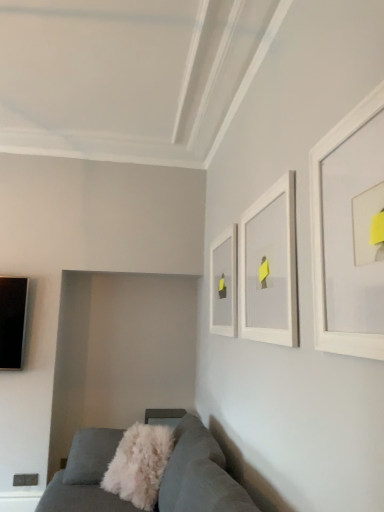
Question: Is velvet grey couch at lower left facing away from white matte picture frame at upper center, the first picture frame positioned from the left?

Choices:
 (A) no
 (B) yes

Answer: (A)

Question: Does velvet grey couch at lower left appear on the left side of white matte picture frame at upper center, which is counted as the 3th picture frame, starting from the right?

Choices:
 (A) no
 (B) yes

Answer: (B)

Question: From the image's perspective, would you say velvet grey couch at lower left is positioned over white matte picture frame at upper center, placed as the third picture frame when sorted from front to back?

Choices:
 (A) yes
 (B) no

Answer: (B)

Question: Does velvet grey couch at lower left turn towards white matte picture frame at upper center, which is the 1th picture frame from back to front?

Choices:
 (A) yes
 (B) no

Answer: (B)

Question: From a real-world perspective, is velvet grey couch at lower left positioned under white matte picture frame at upper center, the first picture frame positioned from the left, based on gravity?

Choices:
 (A) yes
 (B) no

Answer: (A)

Question: Considering their positions, is white fluffy throw pillow at lower center located in front of or behind white matte picture frame at upper center, positioned as the second picture frame in back-to-front order?

Choices:
 (A) behind
 (B) front

Answer: (A)

Question: Is point (134, 482) closer or farther from the camera than point (289, 193)?

Choices:
 (A) closer
 (B) farther

Answer: (B)

Question: From their relative heights in the image, would you say white fluffy throw pillow at lower center is taller or shorter than white matte picture frame at upper center, the second picture frame when ordered from right to left?

Choices:
 (A) short
 (B) tall

Answer: (A)

Question: Is white fluffy throw pillow at lower center bigger or smaller than white matte picture frame at upper center, the second picture frame when ordered from right to left?

Choices:
 (A) small
 (B) big

Answer: (B)

Question: Considering the positions of white matte picture frame at upper right, placed as the third picture frame when sorted from back to front, and white fluffy throw pillow at lower center in the image, is white matte picture frame at upper right, placed as the third picture frame when sorted from back to front, bigger or smaller than white fluffy throw pillow at lower center?

Choices:
 (A) small
 (B) big

Answer: (A)

Question: Is white matte picture frame at upper right, the third picture frame from the left, spatially inside white fluffy throw pillow at lower center, or outside of it?

Choices:
 (A) outside
 (B) inside

Answer: (A)

Question: Based on their positions, is white matte picture frame at upper right, placed as the third picture frame when sorted from back to front, located to the left or right of white fluffy throw pillow at lower center?

Choices:
 (A) left
 (B) right

Answer: (B)

Question: In the image, is white matte picture frame at upper right, which is the first picture frame from right to left, positioned in front of or behind white fluffy throw pillow at lower center?

Choices:
 (A) behind
 (B) front

Answer: (B)

Question: From their relative heights in the image, would you say white fluffy throw pillow at lower center is taller or shorter than white matte picture frame at upper center, which is counted as the 3th picture frame, starting from the right?

Choices:
 (A) short
 (B) tall

Answer: (A)

Question: Would you say white fluffy throw pillow at lower center is to the left or to the right of white matte picture frame at upper center, which is counted as the 3th picture frame, starting from the right, in the picture?

Choices:
 (A) right
 (B) left

Answer: (B)